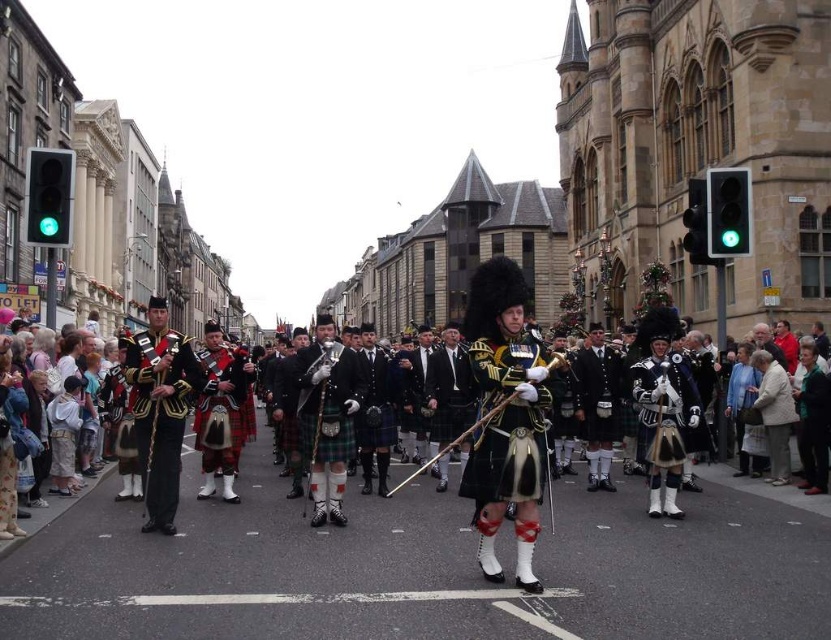
You are a photographer at the parade trying to capture a photo of the shiny gold uniform at center and the green glass traffic light at upper right. From your current position, which object is positioned to the left of the other?

The shiny gold uniform at center is to the left of green glass traffic light at upper right.

You are a photographer positioned at the center of the street during the parade. You want to capture the shiny gold uniform at center in your shot. Based on its position, where should you aim your camera?

The shiny gold uniform at center is located at point (160, 410), so you should aim your camera towards that coordinate to capture it.